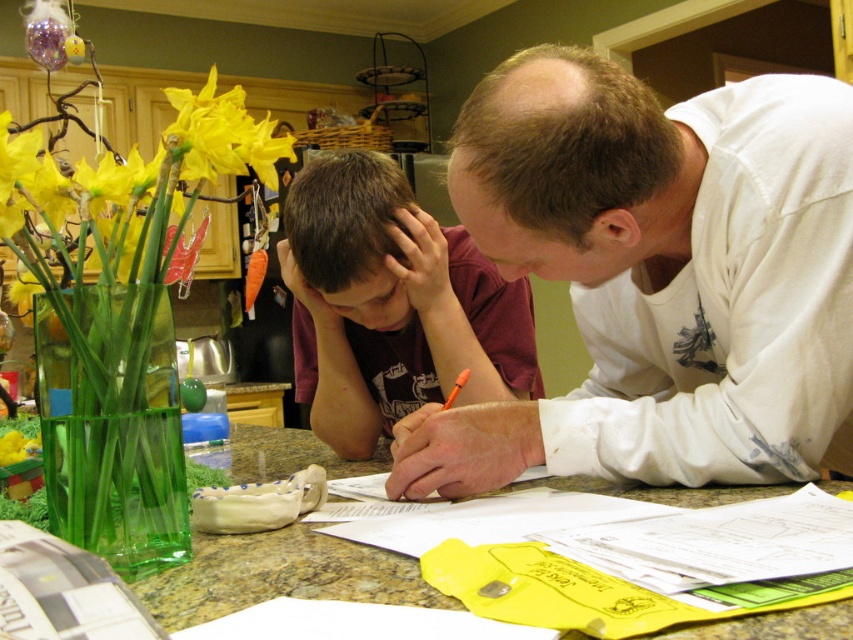
You are a florist who needs to arrange these two items on a shelf. The shelf has a height limit of 1 meter. Can both the yellow matte flowers at left and the green glass vase at center be placed on the shelf without exceeding the height limit?

The yellow matte flowers at left are taller than the green glass vase at center. Since the shelf has a height limit of 1 meter, both items can be placed on the shelf as long as their combined height does not exceed the limit. However, the exact heights are not provided, so it depends on their individual measurements.

You are a guest in this kitchen and want to greet the person with dark brown hair at center. Which direction should you walk to approach them from the white cotton shirt at upper right?

To approach the dark brown hair at center from the white cotton shirt at upper right, you should walk to the left since the white cotton shirt at upper right is positioned to the right of the dark brown hair at center.